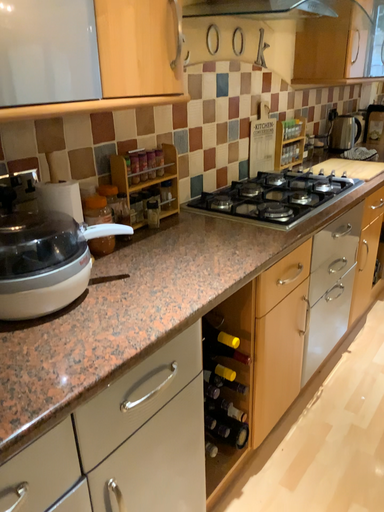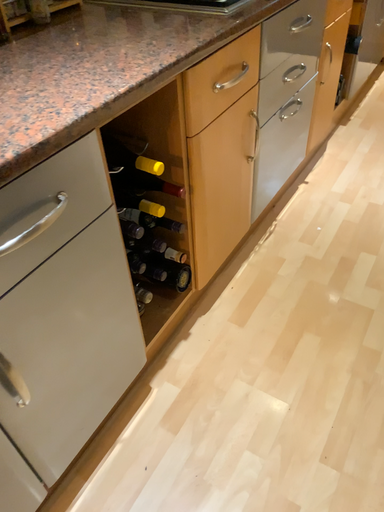
Question: Which way did the camera rotate in the video?

Choices:
 (A) rotated downward
 (B) rotated upward

Answer: (A)